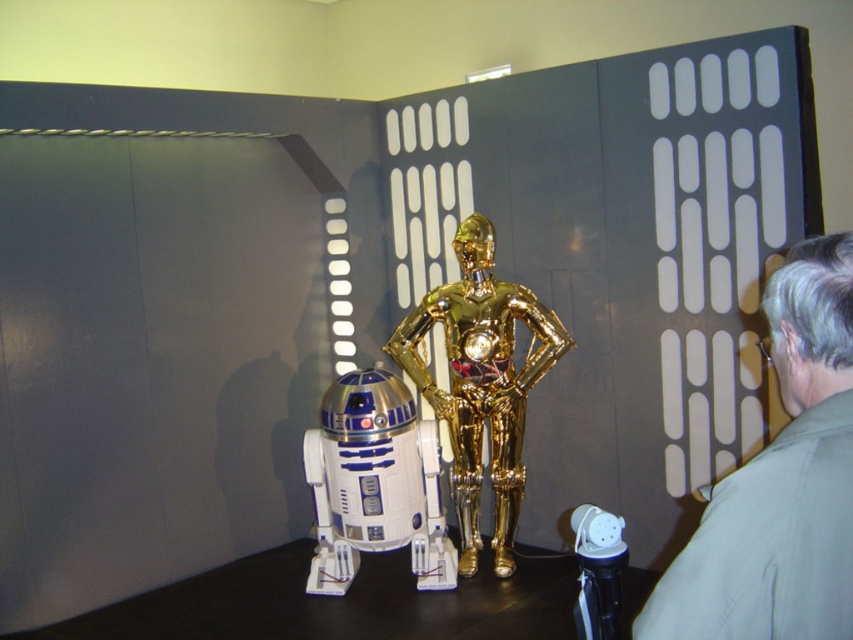
What is the color of the fabric at the point with coordinates (780, 483)?

The fabric at the point with coordinates (780, 483) is gray.

You are a museum visitor who wants to take a photo of both the gray fabric shirt at right and the gold metallic robot at center. Since you can only focus on one object at a time, which object should you aim your camera at first to ensure both are in the frame?

You should aim your camera at the gold metallic robot at center first because the gray fabric shirt at right is to the right of it, so by focusing on the center robot, you can adjust the frame to include both objects.

You are a museum visitor observing the white plastic robot at center and the white plastic toy at lower right. Which object is taller?

The white plastic robot at center is much taller than the white plastic toy at lower right.